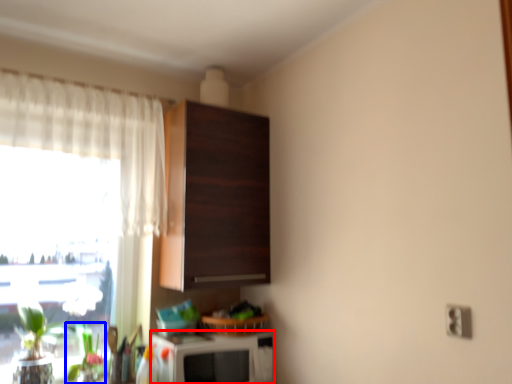
Question: Among these objects, which one is farthest to the camera, appliance (highlighted by a red box) or plant (highlighted by a blue box)?

Choices:
 (A) appliance
 (B) plant

Answer: (B)